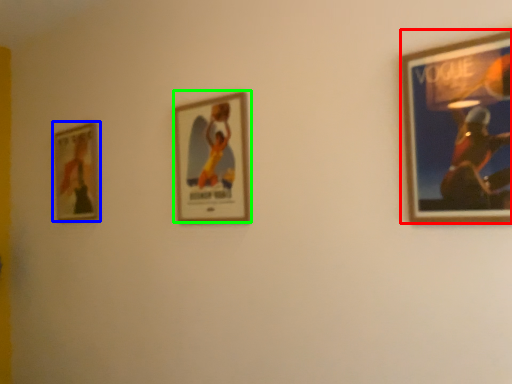
Question: Estimate the real-world distances between objects in this image. Which object is farther from picture frame (highlighted by a red box), picture frame (highlighted by a blue box) or picture frame (highlighted by a green box)?

Choices:
 (A) picture frame
 (B) picture frame

Answer: (A)